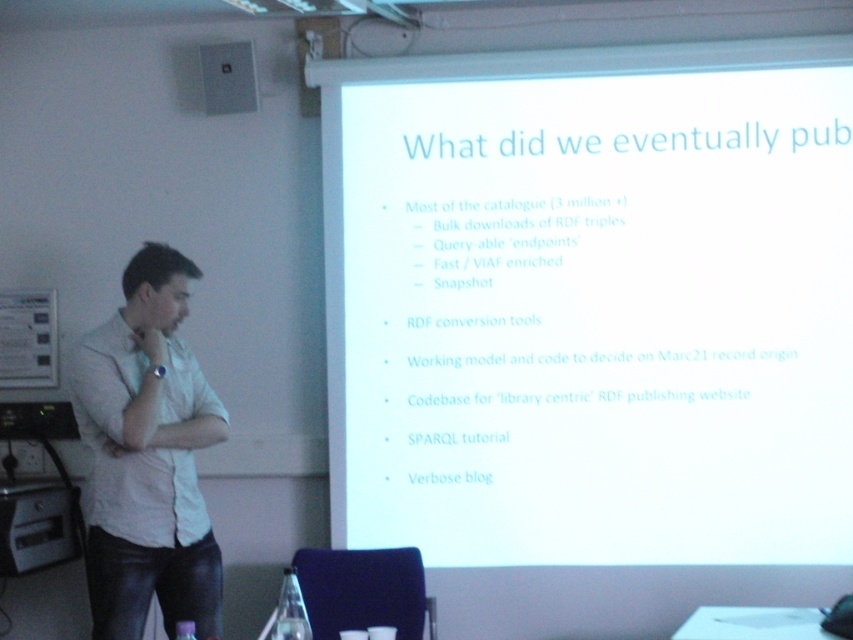
Question: Considering the relative positions of white matte projection screen at upper center and white shirt at left in the image provided, where is white matte projection screen at upper center located with respect to white shirt at left?

Choices:
 (A) above
 (B) below

Answer: (A)

Question: Is white matte projection screen at upper center bigger than white shirt at left?

Choices:
 (A) yes
 (B) no

Answer: (A)

Question: Among these objects, which one is farthest from the camera?

Choices:
 (A) white matte projection screen at upper center
 (B) white shirt at left

Answer: (A)

Question: Among these objects, which one is farthest from the camera?

Choices:
 (A) white matte projection screen at upper center
 (B) white shirt at left

Answer: (A)

Question: Is white matte projection screen at upper center to the left of white shirt at left from the viewer's perspective?

Choices:
 (A) yes
 (B) no

Answer: (B)